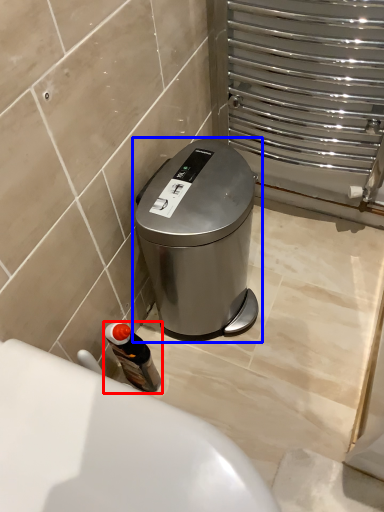
Question: Which object appears closest to the camera in this image, bottle (highlighted by a red box) or waste container (highlighted by a blue box)?

Choices:
 (A) bottle
 (B) waste container

Answer: (B)